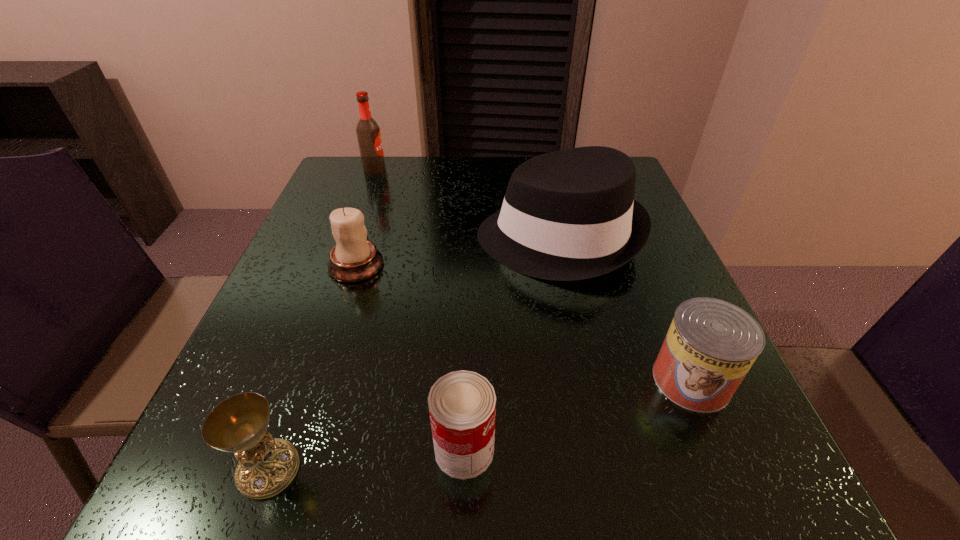
The width and height of the screenshot is (960, 540). Identify the location of vacant point at the near left corner. (218, 469).

Where is `free point at the near right corner`? free point at the near right corner is located at coordinates (723, 460).

Where is `vacant space in between the chalice and the farthest object`? This screenshot has height=540, width=960. vacant space in between the chalice and the farthest object is located at coordinates (322, 320).

Locate an element on the screen. This screenshot has height=540, width=960. vacant area between the beer bottle and the fedora is located at coordinates (467, 204).

Identify the location of free space between the nearer can and the farthest object. (420, 309).

At what (x,y) coordinates should I click in order to perform the action: click on empty space that is in between the beer bottle and the fedora. Please return your answer as a coordinate pair (x, y). This screenshot has height=540, width=960. Looking at the image, I should click on (467, 204).

Identify the location of free space that is in between the farther can and the fedora. The image size is (960, 540). (625, 309).

At what (x,y) coordinates should I click in order to perform the action: click on free space between the nearer can and the chalice. Please return your answer as a coordinate pair (x, y). This screenshot has width=960, height=540. Looking at the image, I should click on (367, 460).

This screenshot has width=960, height=540. In order to click on free space between the chalice and the fedora in this screenshot , I will do `click(414, 354)`.

You are a GUI agent. You are given a task and a screenshot of the screen. Output one action in this format:
    pyautogui.click(x=<x>, y=<y>)
    Task: Click on the free space that is in between the chalice and the beer bottle
    
    Given the screenshot: What is the action you would take?
    pyautogui.click(x=322, y=320)